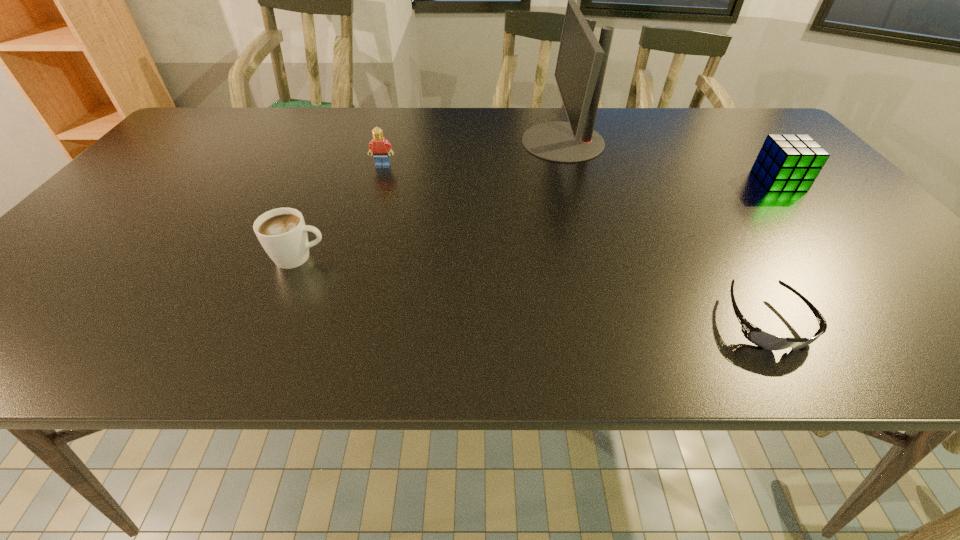
I want to click on the third object from left to right, so click(581, 64).

At what (x,y) coordinates should I click in order to perform the action: click on computer monitor. Please return your answer as a coordinate pair (x, y). Image resolution: width=960 pixels, height=540 pixels. Looking at the image, I should click on (581, 64).

Where is `the second object from left to right`? the second object from left to right is located at coordinates (378, 146).

This screenshot has height=540, width=960. I want to click on the rightmost object, so click(x=787, y=162).

What are the coordinates of `cappuccino` in the screenshot? It's located at (282, 232).

This screenshot has width=960, height=540. I want to click on the leftmost object, so click(x=282, y=232).

Find the location of a particular element. This screenshot has width=960, height=540. the fourth object from left to right is located at coordinates (755, 335).

In order to click on the shortest object in this screenshot , I will do `click(755, 335)`.

I want to click on free region located 0.160m on the screen of the computer monitor, so click(468, 141).

At what (x,y) coordinates should I click in order to perform the action: click on blank space located 0.200m on the screen of the computer monitor. Please return your answer as a coordinate pair (x, y). This screenshot has width=960, height=540. Looking at the image, I should click on (453, 141).